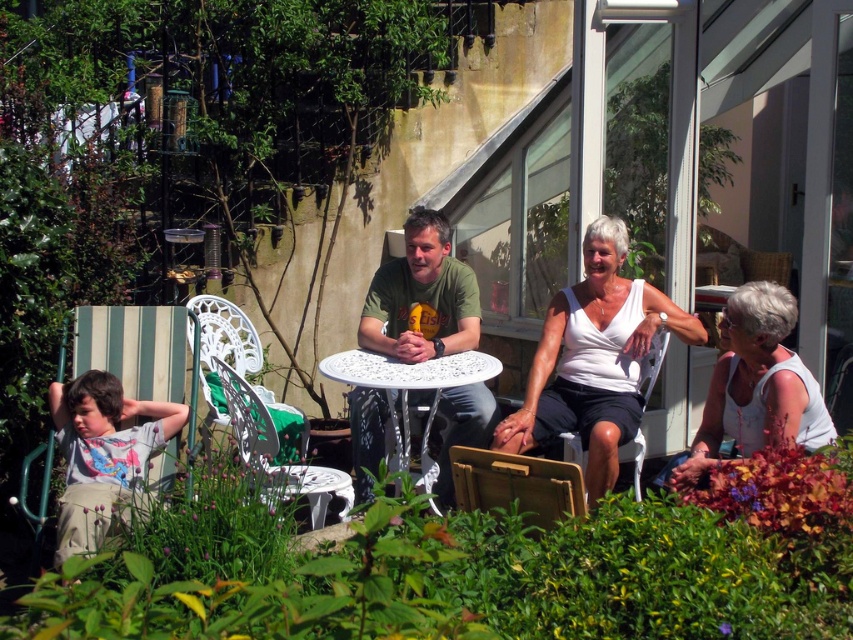
Between white textured chair at center and white metal table at center, which one has less height?

With less height is white metal table at center.

What do you see at coordinates (224, 346) in the screenshot? I see `white textured chair at center` at bounding box center [224, 346].

Which is in front, point (241, 317) or point (471, 381)?

Point (471, 381) is in front.

The width and height of the screenshot is (853, 640). I want to click on white textured chair at center, so click(x=224, y=346).

Is white matte tank top at right bigger than white metal table at center?

Correct, white matte tank top at right is larger in size than white metal table at center.

Is point (756, 400) behind point (471, 371)?

No, (756, 400) is in front of (471, 371).

Where is `white matte tank top at right`? This screenshot has height=640, width=853. white matte tank top at right is located at coordinates (753, 387).

Is white metal chair at center positioned in front of white textured chair at center?

Yes, white metal chair at center is closer to the viewer.

Is white metal chair at center bigger than white textured chair at center?

Correct, white metal chair at center is larger in size than white textured chair at center.

I want to click on white metal chair at center, so click(277, 452).